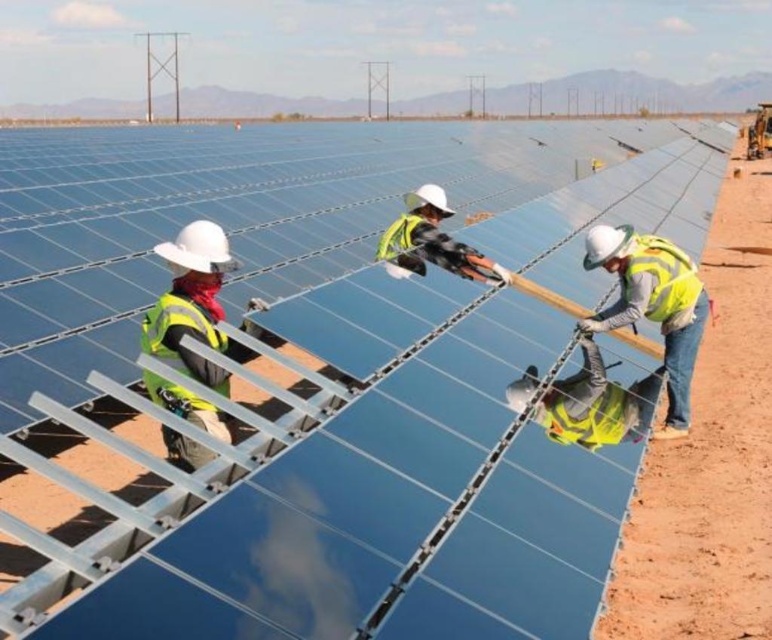
Which is more to the left, reflective silver helmet at center or yellow reflective safety vest at center?

yellow reflective safety vest at center

Is point (407, 216) less distant than point (398, 250)?

No, (407, 216) is further to viewer.

Who is more distant from viewer, (478, 268) or (378, 243)?

The point (378, 243) is behind.

The width and height of the screenshot is (772, 640). Find the location of `reflective silver helmet at center`. reflective silver helmet at center is located at coordinates (432, 243).

Can you confirm if yellow reflective vest at lower right is bigger than reflective silver helmet at center?

Incorrect, yellow reflective vest at lower right is not larger than reflective silver helmet at center.

From the picture: Can you confirm if yellow reflective vest at lower right is positioned to the right of reflective silver helmet at center?

Yes, yellow reflective vest at lower right is to the right of reflective silver helmet at center.

This screenshot has height=640, width=772. What are the coordinates of `yellow reflective vest at lower right` in the screenshot? It's located at (596, 403).

How distant is reflective yellow safety vest at center from yellow reflective safety vest at center?

reflective yellow safety vest at center and yellow reflective safety vest at center are 7.44 feet apart from each other.

Can you confirm if reflective yellow safety vest at center is shorter than yellow reflective safety vest at center?

In fact, reflective yellow safety vest at center may be taller than yellow reflective safety vest at center.

Is point (202, 332) positioned in front of point (408, 212)?

Yes.

The width and height of the screenshot is (772, 640). Identify the location of reflective yellow safety vest at center. pos(193,305).